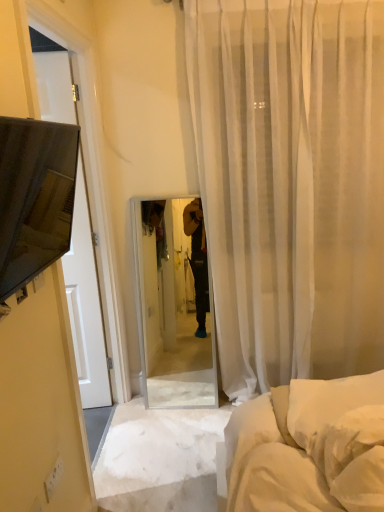
Question: Is white soft pillow at lower right positioned in front of sheer white curtain at center?

Choices:
 (A) yes
 (B) no

Answer: (A)

Question: Is white soft pillow at lower right bigger than sheer white curtain at center?

Choices:
 (A) yes
 (B) no

Answer: (B)

Question: Are white soft pillow at lower right and sheer white curtain at center located far from each other?

Choices:
 (A) yes
 (B) no

Answer: (A)

Question: Does white soft pillow at lower right contain sheer white curtain at center?

Choices:
 (A) no
 (B) yes

Answer: (A)

Question: Is white soft pillow at lower right outside sheer white curtain at center?

Choices:
 (A) no
 (B) yes

Answer: (B)

Question: From a real-world perspective, does white soft pillow at lower right stand above sheer white curtain at center?

Choices:
 (A) yes
 (B) no

Answer: (B)

Question: Is matte black tv at left positioned far away from sheer white curtain at center?

Choices:
 (A) no
 (B) yes

Answer: (B)

Question: Does matte black tv at left have a lesser width compared to sheer white curtain at center?

Choices:
 (A) no
 (B) yes

Answer: (B)

Question: From the image's perspective, does matte black tv at left appear higher than sheer white curtain at center?

Choices:
 (A) yes
 (B) no

Answer: (B)

Question: Is matte black tv at left positioned before sheer white curtain at center?

Choices:
 (A) no
 (B) yes

Answer: (B)

Question: Is matte black tv at left at the right side of sheer white curtain at center?

Choices:
 (A) yes
 (B) no

Answer: (B)

Question: Is matte black tv at left with sheer white curtain at center?

Choices:
 (A) no
 (B) yes

Answer: (A)

Question: Can you confirm if white soft pillow at lower right is taller than matte black tv at left?

Choices:
 (A) no
 (B) yes

Answer: (A)